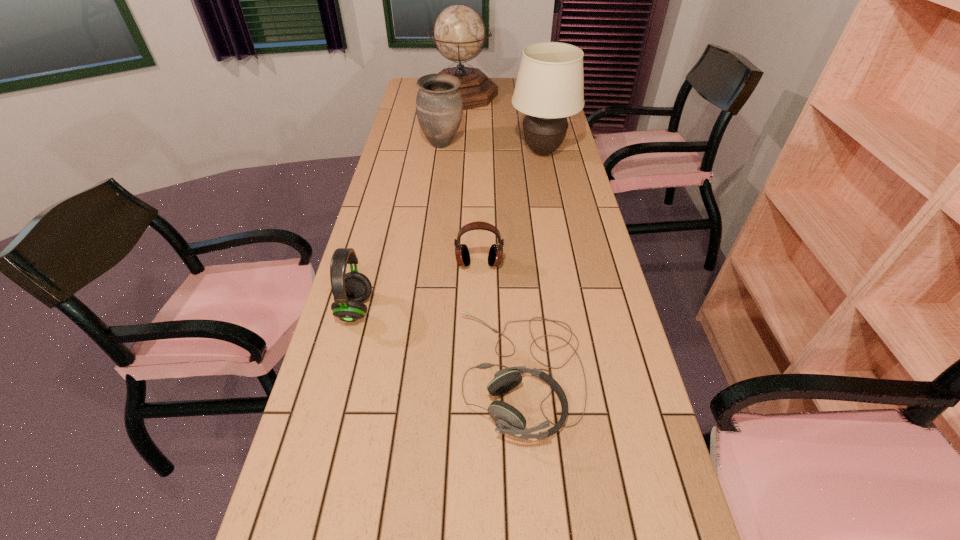
At what (x,y) coordinates should I click in order to perform the action: click on vacant space situated 0.260m on the back of the urn. Please return your answer as a coordinate pair (x, y). Looking at the image, I should click on (446, 106).

What are the coordinates of `free space located on the ear cups of the leftmost object` in the screenshot? It's located at (474, 309).

Locate an element on the screen. The image size is (960, 540). vacant region located 0.250m on the ear pads of the second shortest object is located at coordinates (479, 343).

At what (x,y) coordinates should I click in order to perform the action: click on vacant area located on the outer surface of the shortest object. Please return your answer as a coordinate pair (x, y). This screenshot has width=960, height=540. Looking at the image, I should click on (409, 373).

Locate an element on the screen. free space located on the outer surface of the shortest object is located at coordinates (379, 373).

At what (x,y) coordinates should I click in order to perform the action: click on vacant point located 0.080m on the outer surface of the shortest object. Please return your answer as a coordinate pair (x, y). This screenshot has height=540, width=960. Looking at the image, I should click on (421, 373).

Find the location of a particular element. This screenshot has width=960, height=540. object that is at the far edge is located at coordinates click(x=459, y=33).

What are the coordinates of `globe present at the left edge` in the screenshot? It's located at [459, 33].

The height and width of the screenshot is (540, 960). In order to click on urn situated at the left edge in this screenshot , I will do `click(439, 107)`.

This screenshot has height=540, width=960. Find the location of `headset that is at the left edge`. headset that is at the left edge is located at coordinates (350, 289).